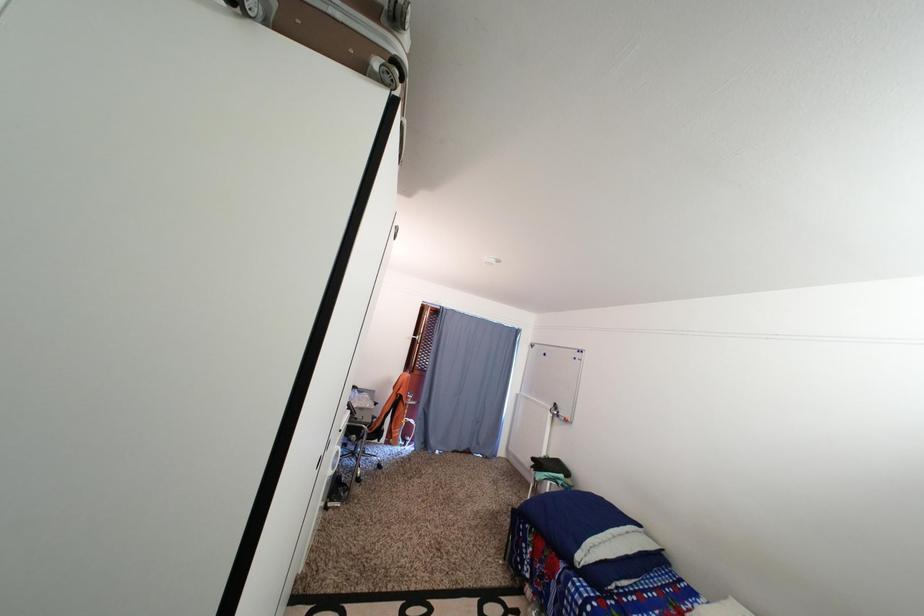
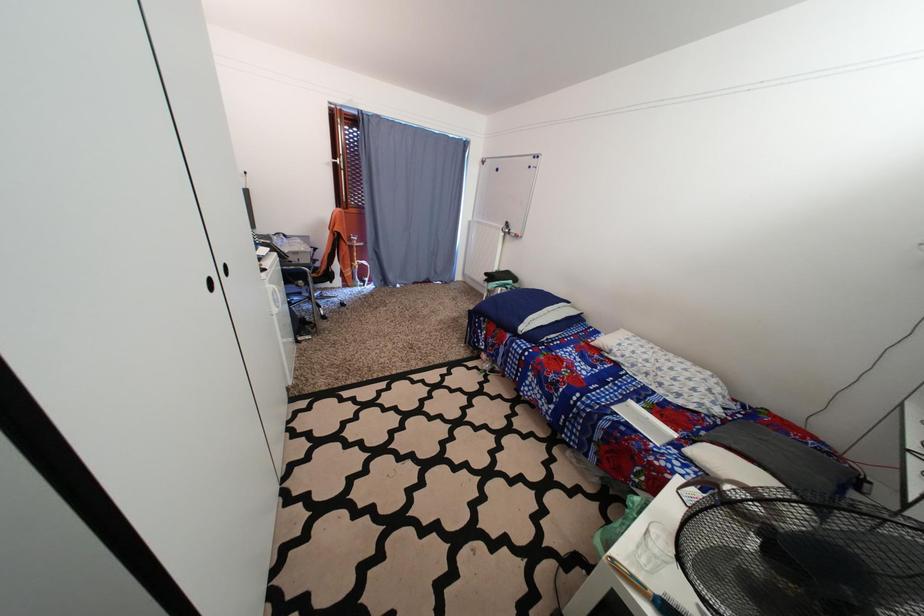
Question: The first image is from the beginning of the video and the second image is from the end. How did the camera likely rotate when shooting the video?

Choices:
 (A) Left
 (B) Right
 (C) Up
 (D) Down

Answer: (D)